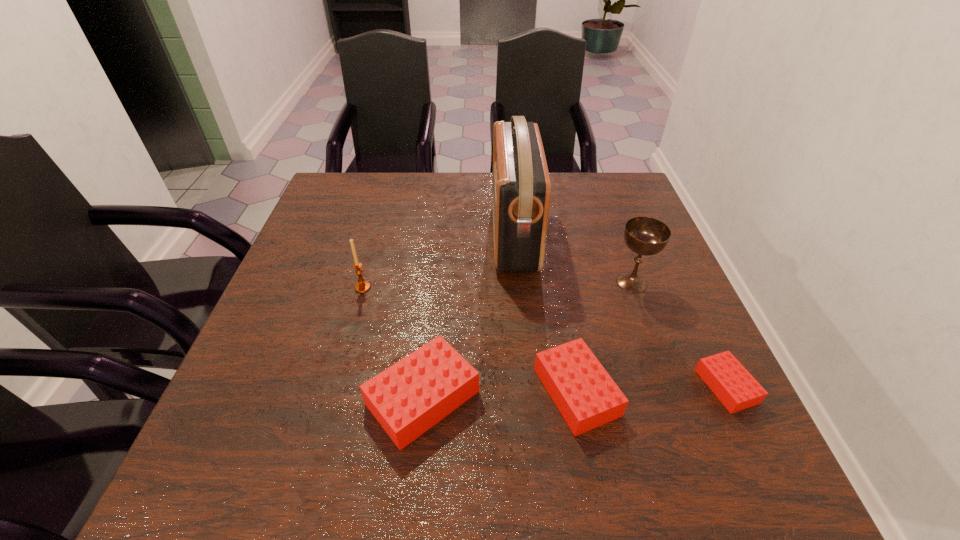
You are a GUI agent. You are given a task and a screenshot of the screen. Output one action in this format:
    pyautogui.click(x=<x>, y=<y>)
    Task: Click on the vacant spot to place a Lego on the left
    
    Given the screenshot: What is the action you would take?
    pyautogui.click(x=266, y=404)